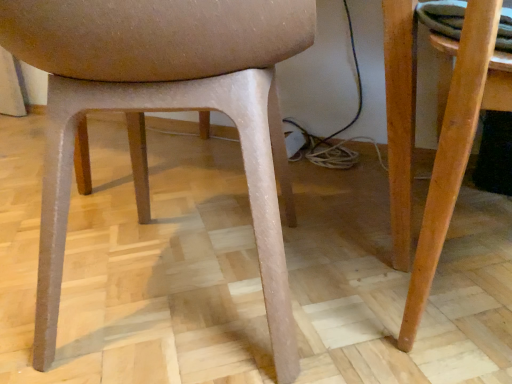
What do you see at coordinates (164, 110) in the screenshot? The height and width of the screenshot is (384, 512). I see `matte plastic chair at center` at bounding box center [164, 110].

At what (x,y) coordinates should I click in order to perform the action: click on matte plastic chair at center. Please return your answer as a coordinate pair (x, y). Looking at the image, I should click on (164, 110).

The width and height of the screenshot is (512, 384). What do you see at coordinates (455, 148) in the screenshot?
I see `wooden table at right` at bounding box center [455, 148].

Locate an element on the screen. The image size is (512, 384). wooden table at right is located at coordinates (455, 148).

In the scene shown: Measure the distance between point (411, 46) and camera.

They are 27.87 inches apart.

Where is `matte plastic chair at center`? The image size is (512, 384). matte plastic chair at center is located at coordinates (164, 110).

In the scene shown: Which object is positioned more to the right, matte plastic chair at center or wooden table at right?

Positioned to the right is wooden table at right.

Does matte plastic chair at center come behind wooden table at right?

No.

Does point (151, 64) come behind point (470, 152)?

That is False.

From the image's perspective, who appears lower, matte plastic chair at center or wooden table at right?

From the image's view, wooden table at right is below.

From a real-world perspective, is matte plastic chair at center positioned above or below wooden table at right?

In terms of real-world spatial position, matte plastic chair at center is above wooden table at right.

Considering the sizes of objects matte plastic chair at center and wooden table at right in the image provided, who is wider, matte plastic chair at center or wooden table at right?

matte plastic chair at center is wider.

Is matte plastic chair at center taller or shorter than wooden table at right?

Considering their sizes, matte plastic chair at center has more height than wooden table at right.

Who is smaller, matte plastic chair at center or wooden table at right?

Smaller between the two is wooden table at right.

Choose the correct answer: Is matte plastic chair at center inside wooden table at right or outside it?

matte plastic chair at center lies outside wooden table at right.

Can you see matte plastic chair at center touching wooden table at right?

There is a gap between matte plastic chair at center and wooden table at right.

Is matte plastic chair at center turned away from wooden table at right?

No, matte plastic chair at center is not facing away from wooden table at right.

Can you tell me how much matte plastic chair at center and wooden table at right differ in facing direction?

They differ by 15.5 degrees in their facing directions.

There is a wooden table at right. At what (x,y) coordinates should I click in order to perform the action: click on chair above it (from a real-world perspective). Please return your answer as a coordinate pair (x, y). This screenshot has height=384, width=512. Looking at the image, I should click on (164, 110).

Considering the positions of objects wooden table at right and matte plastic chair at center in the image provided, who is more to the left, wooden table at right or matte plastic chair at center?

matte plastic chair at center.

Which object is more forward, wooden table at right or matte plastic chair at center?

Positioned in front is matte plastic chair at center.

Considering the points (487, 99) and (295, 225), which point is in front, point (487, 99) or point (295, 225)?

Point (487, 99)

From the image's perspective, which is above, wooden table at right or matte plastic chair at center?

matte plastic chair at center appears higher in the image.

From a real-world perspective, which is physically above, wooden table at right or matte plastic chair at center?

In real-world perspective, matte plastic chair at center is above.

From the picture: Does wooden table at right have a lesser width compared to matte plastic chair at center?

Yes, wooden table at right is thinner than matte plastic chair at center.

Considering the relative sizes of wooden table at right and matte plastic chair at center in the image provided, is wooden table at right taller than matte plastic chair at center?

In fact, wooden table at right may be shorter than matte plastic chair at center.

Does wooden table at right have a smaller size compared to matte plastic chair at center?

Yes, wooden table at right is smaller than matte plastic chair at center.

Is wooden table at right situated inside matte plastic chair at center or outside?

The correct answer is: outside.

Is wooden table at right beside matte plastic chair at center?

They are not placed beside each other.

Does wooden table at right turn towards matte plastic chair at center?

No.

The width and height of the screenshot is (512, 384). Find the location of `table that is on the right side of matte plastic chair at center`. table that is on the right side of matte plastic chair at center is located at coordinates (455, 148).

At what (x,y) coordinates should I click in order to perform the action: click on table to the right of matte plastic chair at center. Please return your answer as a coordinate pair (x, y). The width and height of the screenshot is (512, 384). Looking at the image, I should click on (455, 148).

At what (x,y) coordinates should I click in order to perform the action: click on chair located on the left of wooden table at right. Please return your answer as a coordinate pair (x, y). Looking at the image, I should click on (164, 110).